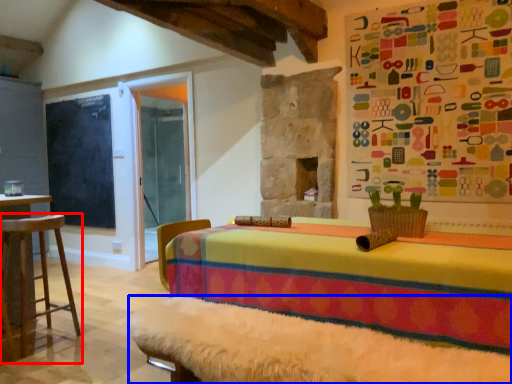
Question: Which point is further to the camera, furniture (highlighted by a red box) or bed frame (highlighted by a blue box)?

Choices:
 (A) furniture
 (B) bed frame

Answer: (A)